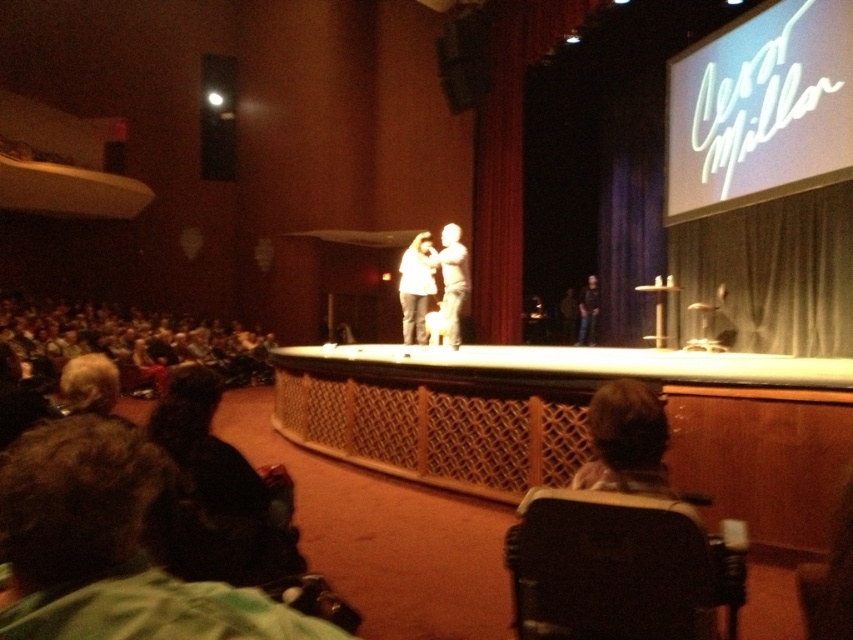
Question: Which object is the farthest from the black plastic chair at lower right?

Choices:
 (A) black fabric person at center
 (B) white matte shirt at center

Answer: (A)

Question: Which object appears farthest from the camera in this image?

Choices:
 (A) black plastic chair at lower right
 (B) black fabric person at center
 (C) white fabric shirt at center
 (D) white matte shirt at center

Answer: (B)

Question: Where is white matte shirt at center located in relation to black fabric person at center in the image?

Choices:
 (A) right
 (B) left

Answer: (B)

Question: Considering the relative positions of white fabric shirt at center and white matte shirt at center in the image provided, where is white fabric shirt at center located with respect to white matte shirt at center?

Choices:
 (A) left
 (B) right

Answer: (B)

Question: Based on their relative distances, which object is nearer to the white fabric shirt at center?

Choices:
 (A) black plastic chair at lower right
 (B) black fabric person at center

Answer: (B)

Question: Is white fabric shirt at center wider than white matte shirt at center?

Choices:
 (A) yes
 (B) no

Answer: (A)